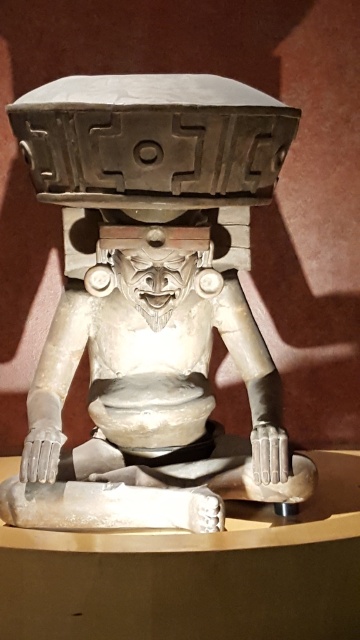
You are an art conservator examining the ancient stone sculpture. You need to determine if the white matte sculpture at center can fit through a doorway that is narrower than the white stone carving at center. Can it fit?

The white matte sculpture at center might be wider than the white stone carving at center, so it may not fit through the doorway if the doorway is narrower than the white stone carving at center.

You are an art conservator examining the ancient stone sculpture. You notice two parts of the sculpture labeled as the white matte sculpture at center and the white stone carving at center. According to the description, which one is positioned to the right of the other?

The white matte sculpture at center is positioned to the right of the white stone carving at center.

You are an art conservator examining the ancient stone sculpture. You notice two parts of the sculpture labeled as the white matte sculpture at center and the white stone carving at center. Which part is positioned lower in the artwork?

The white matte sculpture at center is positioned lower than the white stone carving at center.